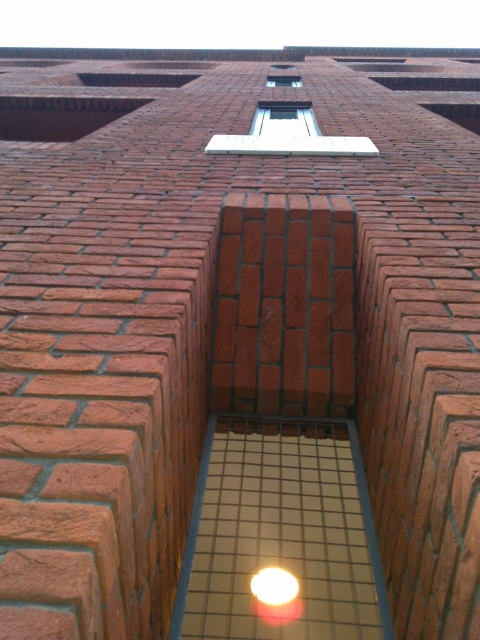
Question: Which point is closer to the camera taking this photo?

Choices:
 (A) (273, 109)
 (B) (295, 76)

Answer: (A)

Question: Is the position of clear glass window at center more distant than that of clear glass window at upper center?

Choices:
 (A) yes
 (B) no

Answer: (B)

Question: Among these points, which one is farthest from the camera?

Choices:
 (A) (271, 81)
 (B) (296, 113)

Answer: (A)

Question: Does clear glass window at center have a greater width compared to clear glass window at upper center?

Choices:
 (A) no
 (B) yes

Answer: (B)

Question: Can you confirm if clear glass window at center is thinner than clear glass window at upper center?

Choices:
 (A) no
 (B) yes

Answer: (A)